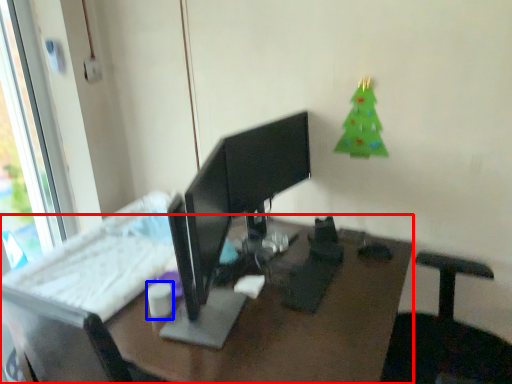
Question: Which point is further to the camera, desk (highlighted by a red box) or tableware (highlighted by a blue box)?

Choices:
 (A) desk
 (B) tableware

Answer: (B)